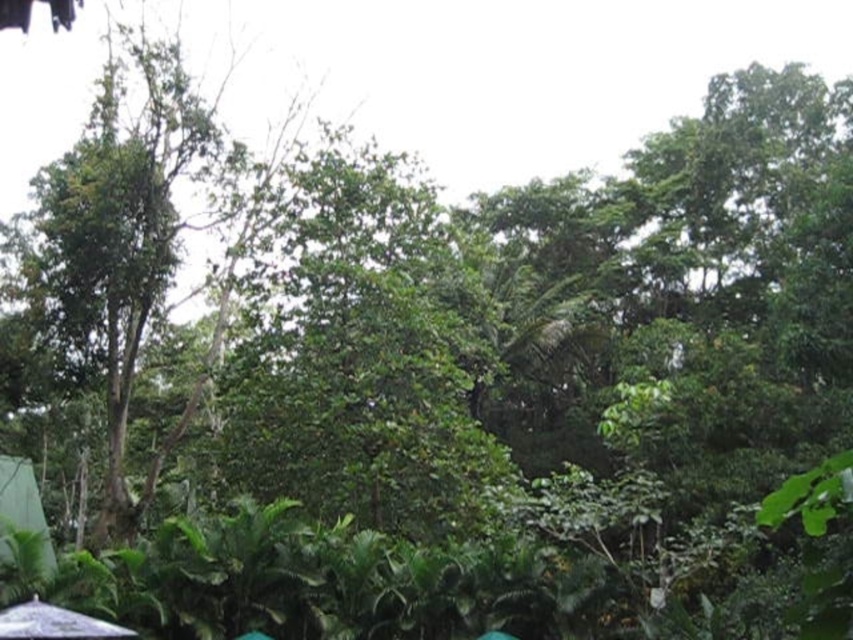
Question: Which object is farther from the camera taking this photo?

Choices:
 (A) white matte umbrella at lower left
 (B) green leafy canopy at lower left

Answer: (B)

Question: Is green leafy canopy at lower left positioned at the back of white matte umbrella at lower left?

Choices:
 (A) no
 (B) yes

Answer: (B)

Question: Is green leafy canopy at lower left in front of white matte umbrella at lower left?

Choices:
 (A) no
 (B) yes

Answer: (A)

Question: Does green leafy canopy at lower left have a larger size compared to white matte umbrella at lower left?

Choices:
 (A) no
 (B) yes

Answer: (A)